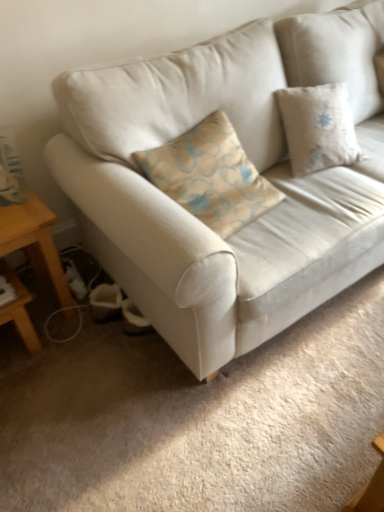
Question: Is suede-like beige couch at center in contact with wooden table at lower left?

Choices:
 (A) no
 (B) yes

Answer: (A)

Question: From a real-world perspective, is suede-like beige couch at center physically below wooden table at lower left?

Choices:
 (A) yes
 (B) no

Answer: (B)

Question: Is suede-like beige couch at center aimed at wooden table at lower left?

Choices:
 (A) no
 (B) yes

Answer: (A)

Question: From a real-world perspective, is suede-like beige couch at center positioned over wooden table at lower left based on gravity?

Choices:
 (A) no
 (B) yes

Answer: (B)

Question: Does suede-like beige couch at center have a greater height compared to wooden table at lower left?

Choices:
 (A) no
 (B) yes

Answer: (B)

Question: Is suede-like beige couch at center at the right side of wooden table at lower left?

Choices:
 (A) no
 (B) yes

Answer: (B)

Question: From the image's perspective, is wooden table at lower left under suede-like beige couch at center?

Choices:
 (A) yes
 (B) no

Answer: (A)

Question: From a real-world perspective, is wooden table at lower left on suede-like beige couch at center?

Choices:
 (A) no
 (B) yes

Answer: (A)

Question: Is wooden table at lower left to the right of suede-like beige couch at center from the viewer's perspective?

Choices:
 (A) no
 (B) yes

Answer: (A)

Question: Is the depth of wooden table at lower left less than that of suede-like beige couch at center?

Choices:
 (A) yes
 (B) no

Answer: (B)

Question: Does wooden table at lower left have a lesser height compared to suede-like beige couch at center?

Choices:
 (A) yes
 (B) no

Answer: (A)

Question: From a real-world perspective, is wooden table at lower left below suede-like beige couch at center?

Choices:
 (A) yes
 (B) no

Answer: (A)

Question: From a real-world perspective, is wooden table at lower left physically located above or below suede-like beige couch at center?

Choices:
 (A) above
 (B) below

Answer: (B)